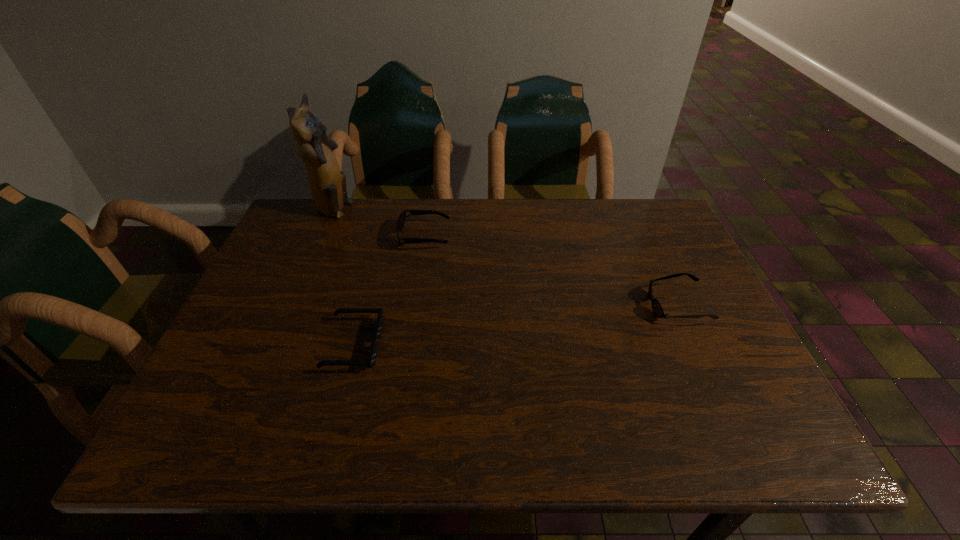
Where is `free spot located on the front-facing side of the shortest object`? The width and height of the screenshot is (960, 540). free spot located on the front-facing side of the shortest object is located at coordinates (483, 345).

The image size is (960, 540). I want to click on cat that is at the far edge, so click(x=327, y=183).

Find the location of a particular element. The image size is (960, 540). sunglasses that is at the far edge is located at coordinates (402, 217).

The width and height of the screenshot is (960, 540). What are the coordinates of `object that is positioned at the left edge` in the screenshot? It's located at (327, 183).

You are a GUI agent. You are given a task and a screenshot of the screen. Output one action in this format:
    pyautogui.click(x=<x>, y=<y>)
    Task: Click on the object located in the right edge section of the desktop
    
    Given the screenshot: What is the action you would take?
    (657, 308)

Locate an element on the screen. This screenshot has height=540, width=960. object located at the far left corner is located at coordinates (327, 183).

Identify the location of vacant area at the far edge of the desktop. (466, 246).

The height and width of the screenshot is (540, 960). In the image, there is a desktop. Find the location of `vacant space at the near edge`. vacant space at the near edge is located at coordinates (444, 449).

Locate an element on the screen. free space at the left edge of the desktop is located at coordinates (x=247, y=322).

You are a GUI agent. You are given a task and a screenshot of the screen. Output one action in this format:
    pyautogui.click(x=<x>, y=<y>)
    Task: Click on the vacant area at the right edge of the desktop
    
    Given the screenshot: What is the action you would take?
    pyautogui.click(x=690, y=283)